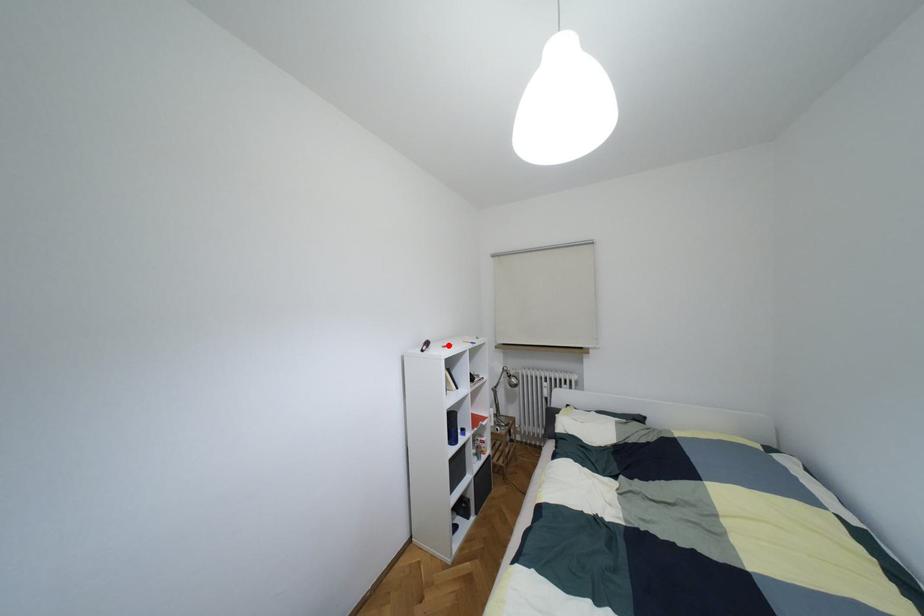
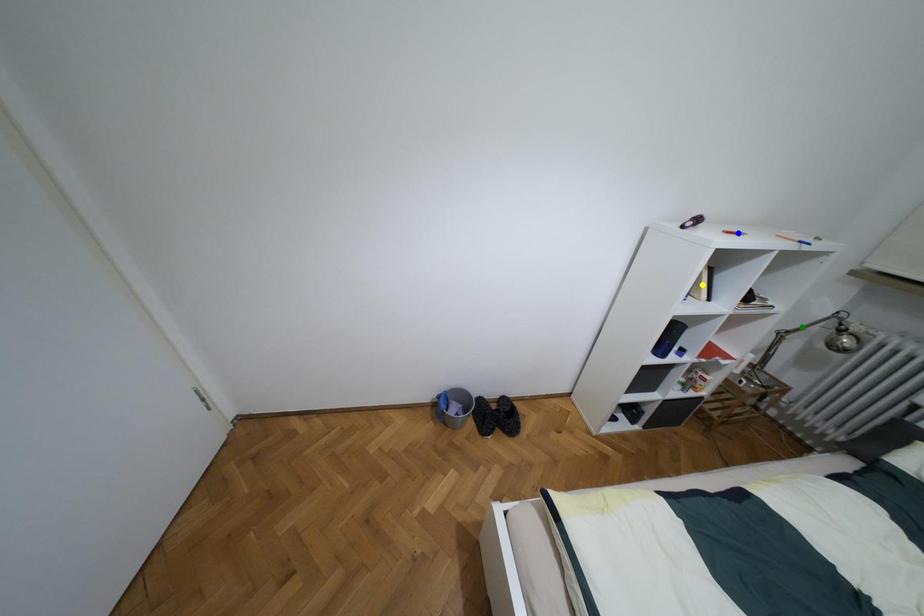
Question: I am providing you with two images of the same scene from different viewpoints. A red point is marked on the first image. You are given multiple points on the second image. Can you choose the point in image 2 that corresponds to the point in image 1?

Choices:
 (A) blue point
 (B) green point
 (C) yellow point

Answer: (A)